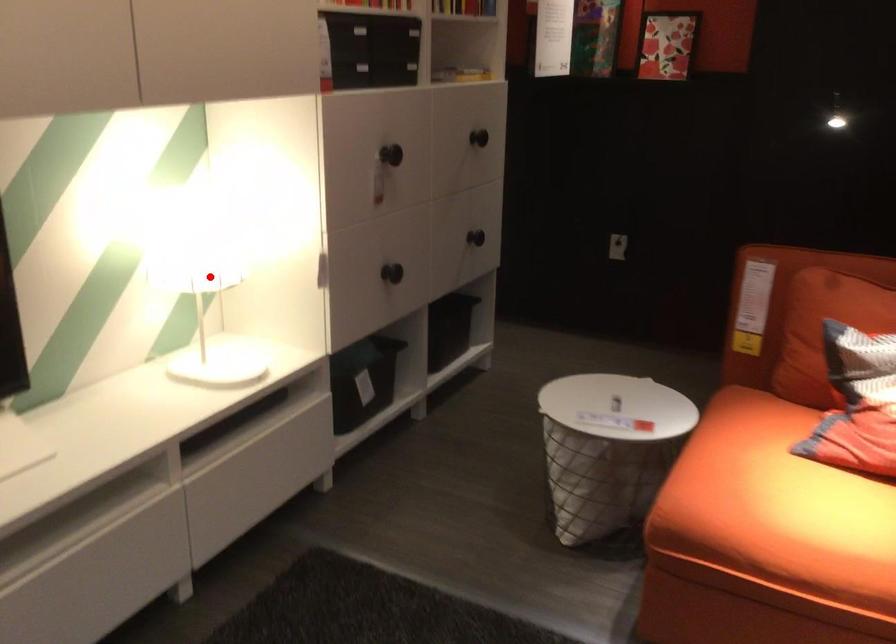
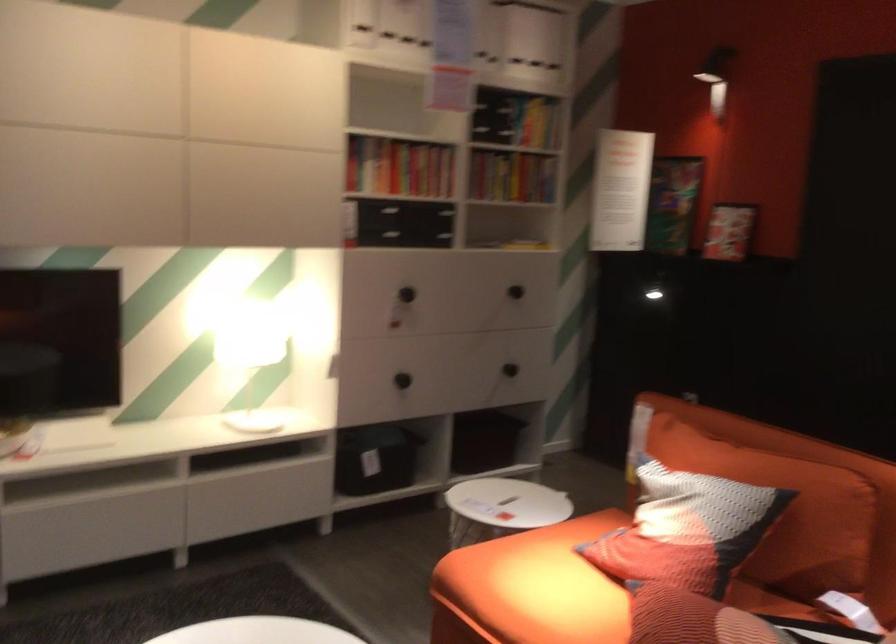
Question: I am providing you with two images of the same scene from different viewpoints. Image1 has a red point marked. In image2, the corresponding 3D location appears at what relative position? Reply with the corresponding letter.

Choices:
 (A) Closer
 (B) Farther

Answer: (B)